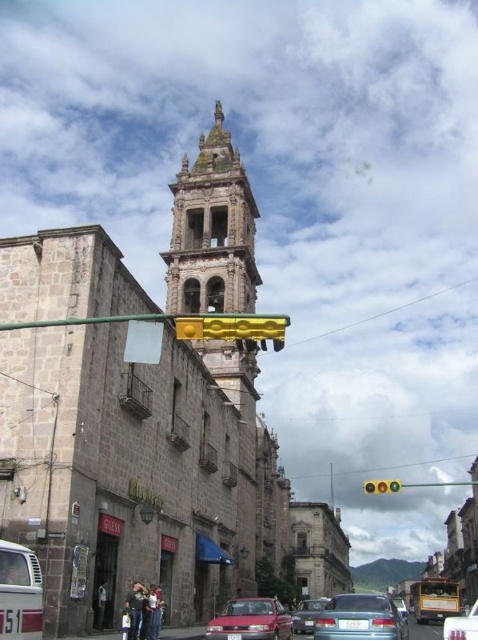
Question: Is stone church at center above metallic silver sedan at center?

Choices:
 (A) no
 (B) yes

Answer: (B)

Question: Estimate the real-world distances between objects in this image. Which object is farther from the metallic silver car at center?

Choices:
 (A) metallic silver sedan at center
 (B) matte red sedan at center
 (C) metallic gray sedan at center
 (D) stone bell tower at center

Answer: (D)

Question: Which object is positioned farthest from the stone bell tower at center?

Choices:
 (A) stone church at center
 (B) matte red car at center

Answer: (B)

Question: Is metallic silver car at center above matte red sedan at center?

Choices:
 (A) no
 (B) yes

Answer: (B)

Question: Can you confirm if stone bell tower at center is bigger than metallic silver sedan at center?

Choices:
 (A) yes
 (B) no

Answer: (B)

Question: Which point appears farthest from the camera in this image?

Choices:
 (A) (41, 448)
 (B) (252, 604)

Answer: (B)